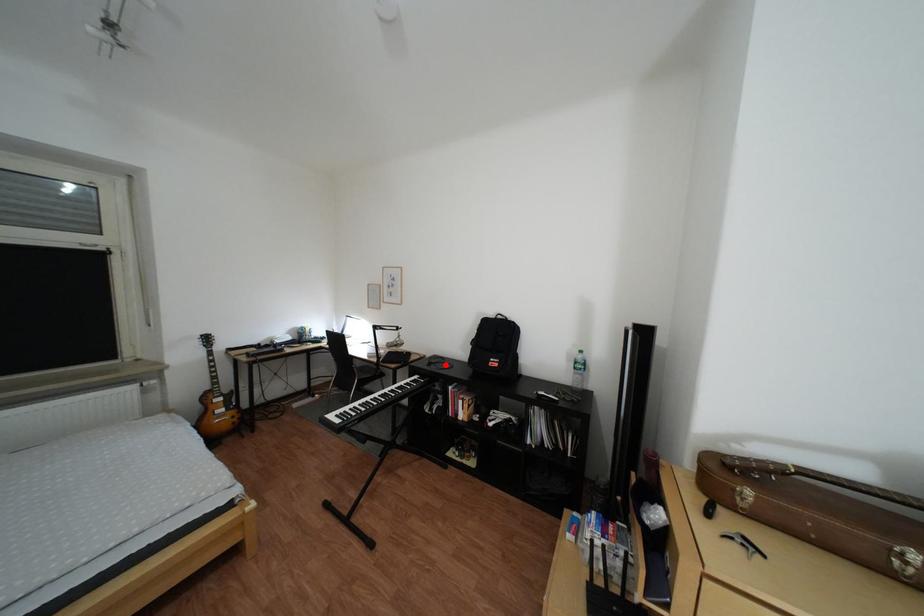
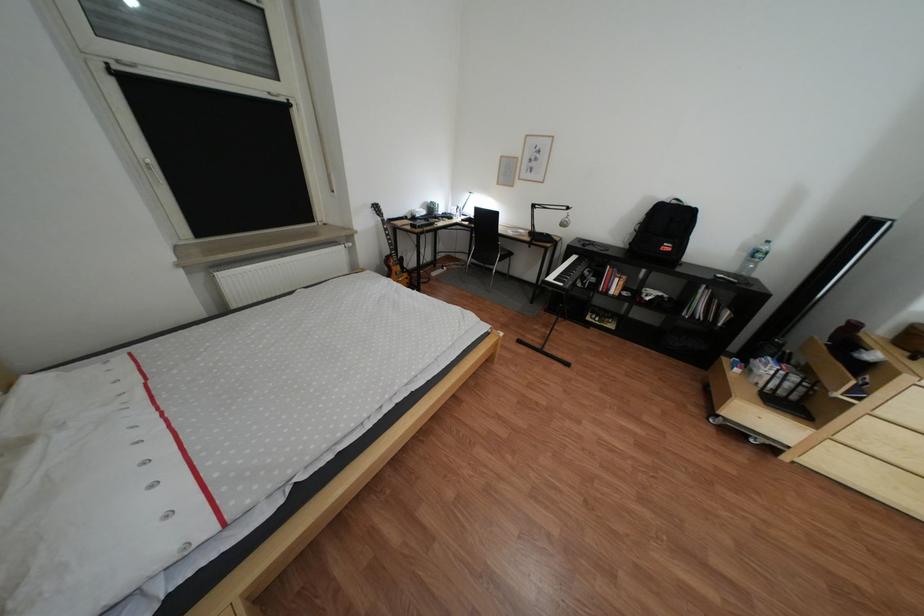
Question: A red point is marked in image1. In image2, is the corresponding 3D point closer to the camera or farther? Reply with the corresponding letter.

Choices:
 (A) The corresponding 3D point is closer.
 (B) The corresponding 3D point is farther.

Answer: (A)